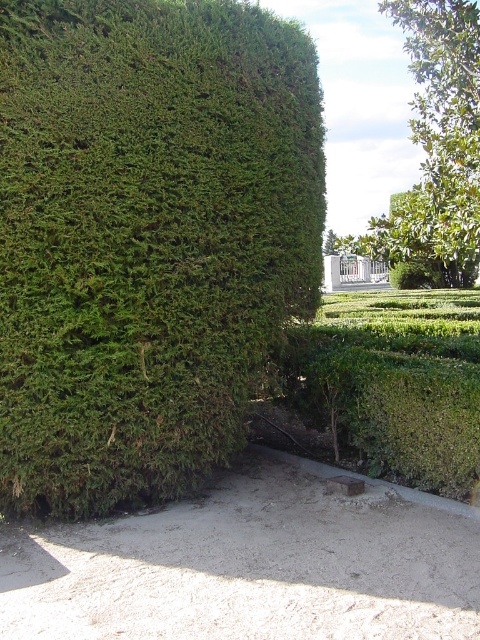
Question: Considering the relative positions of green leafy hedge at left and green leafy tree at upper right in the image provided, where is green leafy hedge at left located with respect to green leafy tree at upper right?

Choices:
 (A) above
 (B) below

Answer: (B)

Question: Considering the relative positions of green leafy hedge at left and green leafy tree at upper right in the image provided, where is green leafy hedge at left located with respect to green leafy tree at upper right?

Choices:
 (A) left
 (B) right

Answer: (A)

Question: Which point appears closest to the camera in this image?

Choices:
 (A) (311, 301)
 (B) (408, 13)

Answer: (A)

Question: Can you confirm if green leafy hedge at left is positioned to the right of green leafy tree at upper right?

Choices:
 (A) yes
 (B) no

Answer: (B)

Question: Which point is farther to the camera?

Choices:
 (A) (443, 132)
 (B) (27, 120)

Answer: (A)

Question: Which point is closer to the camera?

Choices:
 (A) green leafy hedge at left
 (B) green leafy tree at upper right

Answer: (A)